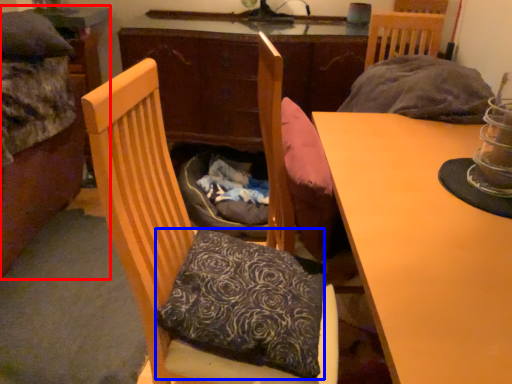
Question: Which point is further to the camera, bed (highlighted by a red box) or pillow (highlighted by a blue box)?

Choices:
 (A) bed
 (B) pillow

Answer: (A)